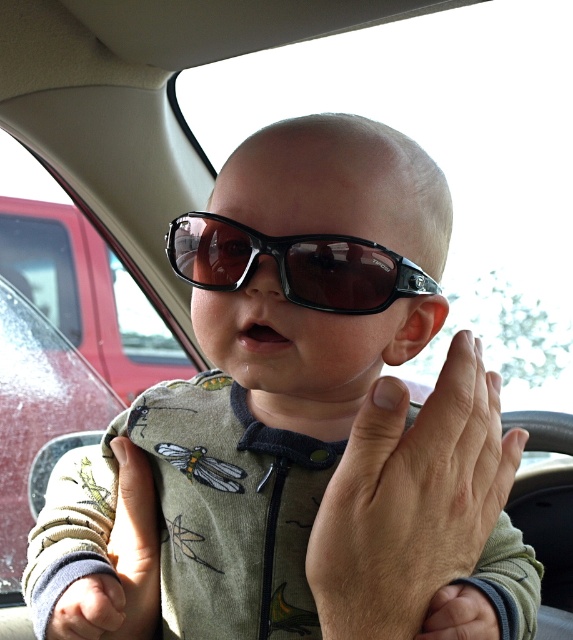
Question: Which object is farther from the camera taking this photo?

Choices:
 (A) matte black sunglasses at center
 (B) smooth skin hand at center
 (C) soft beige fabric hand at lower left
 (D) black plastic goggles at center

Answer: (C)

Question: Does smooth skin hand at center appear under soft beige fabric hand at lower left?

Choices:
 (A) yes
 (B) no

Answer: (B)

Question: Does matte black sunglasses at center have a larger size compared to black plastic goggles at center?

Choices:
 (A) yes
 (B) no

Answer: (A)

Question: Among these points, which one is farthest from the camera?

Choices:
 (A) (348, 298)
 (B) (134, 550)

Answer: (B)

Question: Which object is closer to the camera taking this photo?

Choices:
 (A) matte black sunglasses at center
 (B) black plastic goggles at center

Answer: (A)

Question: Does smooth skin hand at center have a larger size compared to black plastic goggles at center?

Choices:
 (A) yes
 (B) no

Answer: (A)